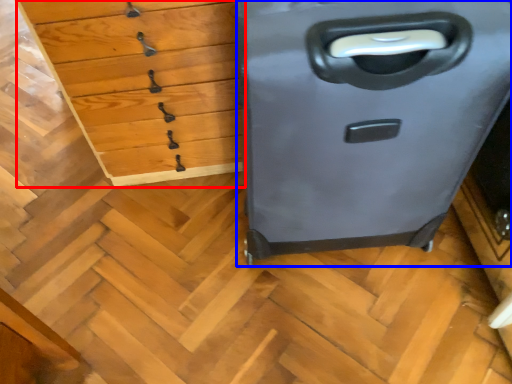
Question: Which object is further to the camera taking this photo, chest of drawers (highlighted by a red box) or file cabinet (highlighted by a blue box)?

Choices:
 (A) chest of drawers
 (B) file cabinet

Answer: (A)